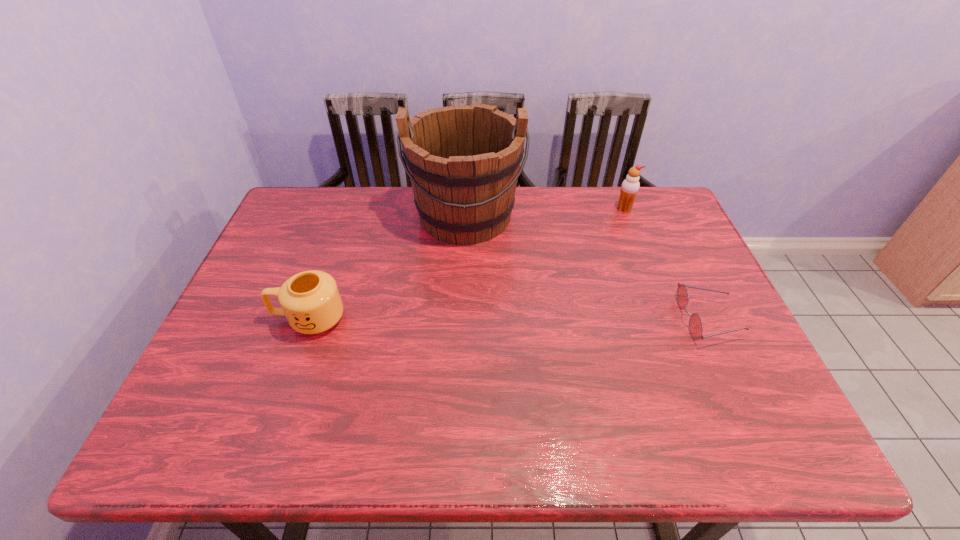
Where is `free space on the desktop that is between the mug and the rightmost object and is positioned at the front with a straw on the icecream`? free space on the desktop that is between the mug and the rightmost object and is positioned at the front with a straw on the icecream is located at coordinates (533, 320).

At what (x,y) coordinates should I click in order to perform the action: click on free space on the desktop that is between the third tallest object and the shortest object and is positioned on the side of the second object from left to right with the handle for carrying. Please return your answer as a coordinate pair (x, y). The image size is (960, 540). Looking at the image, I should click on (462, 319).